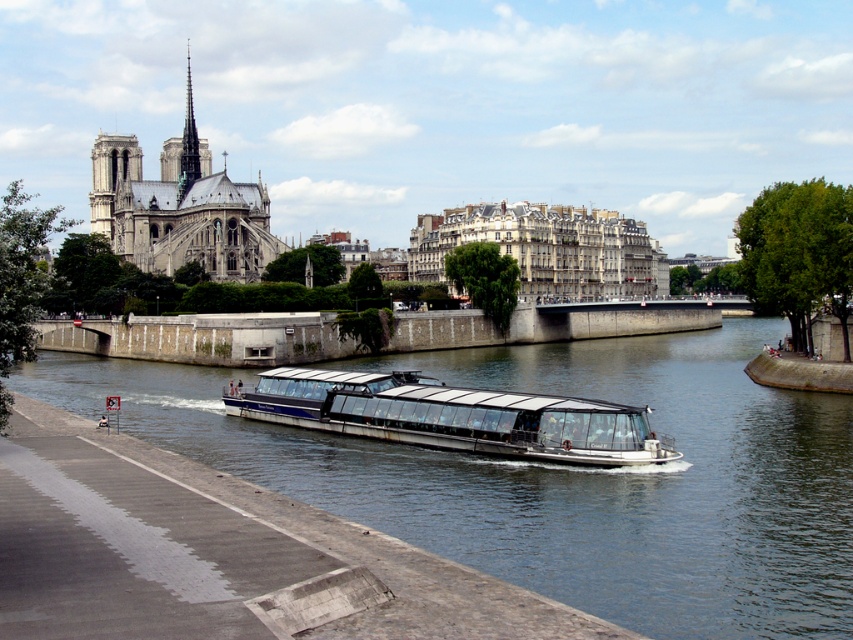
Question: Which of these objects is positioned farthest from the stone gothic cathedral at upper left?

Choices:
 (A) white matte glass boat at center
 (B) clear water at center

Answer: (A)

Question: Does clear water at center appear on the left side of stone gothic cathedral at upper left?

Choices:
 (A) yes
 (B) no

Answer: (B)

Question: Among these points, which one is nearest to the camera?

Choices:
 (A) [462, 438]
 (B) [181, 180]
 (C) [685, 483]

Answer: (C)

Question: Is white matte glass boat at center smaller than stone gothic cathedral at upper left?

Choices:
 (A) no
 (B) yes

Answer: (B)

Question: Which of these objects is positioned closest to the clear water at center?

Choices:
 (A) stone gothic cathedral at upper left
 (B) white matte glass boat at center

Answer: (B)

Question: Is white matte glass boat at center to the right of stone gothic cathedral at upper left from the viewer's perspective?

Choices:
 (A) yes
 (B) no

Answer: (A)